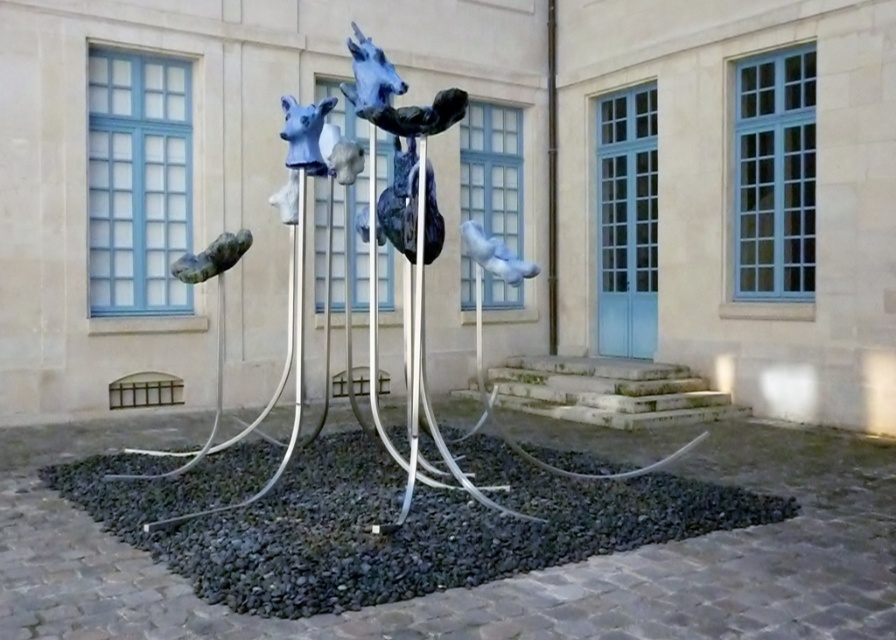
Question: Does metallic blue horse heads at center appear under matte blue bird at center?

Choices:
 (A) yes
 (B) no

Answer: (A)

Question: Does metallic blue horse heads at center have a larger size compared to green matte sculpture at lower left?

Choices:
 (A) no
 (B) yes

Answer: (B)

Question: Is metallic blue horse heads at center below green matte sculpture at lower left?

Choices:
 (A) yes
 (B) no

Answer: (A)

Question: Which object appears farthest from the camera in this image?

Choices:
 (A) green matte sculpture at lower left
 (B) matte blue bird at center

Answer: (A)

Question: Which point is farther to the camera?

Choices:
 (A) metallic blue horse heads at center
 (B) matte blue bird at center
 (C) green matte sculpture at lower left

Answer: (C)

Question: Which is farther from the green matte sculpture at lower left?

Choices:
 (A) matte blue bird at center
 (B) metallic blue horse heads at center

Answer: (B)